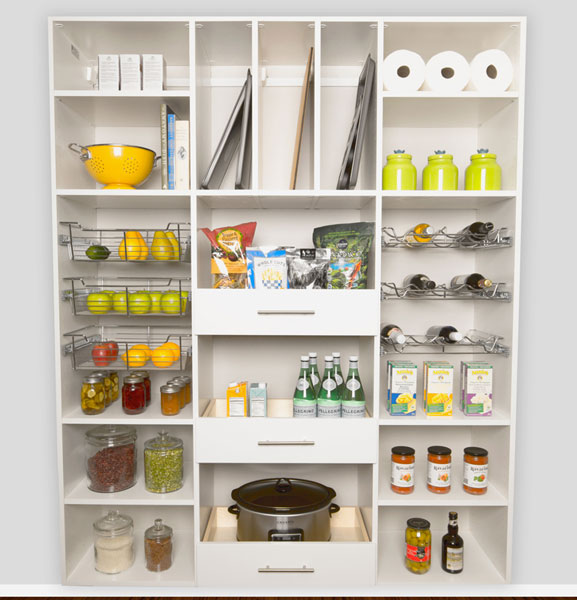
What are the coordinates of `inside bottom of shelf` in the screenshot? It's located at (138, 571), (138, 495), (417, 492), (392, 556), (458, 410), (153, 409).